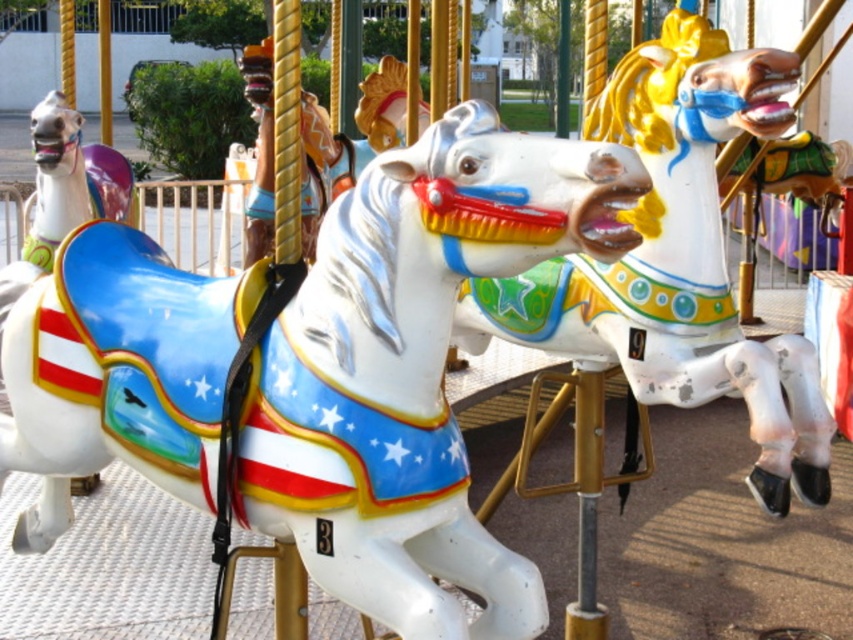
Does painted wood horse at center appear on the right side of shiny white horse at left?

Correct, you'll find painted wood horse at center to the right of shiny white horse at left.

Does painted wood horse at center appear under shiny white horse at left?

Yes.

Does point (740, 90) come closer to viewer compared to point (71, 131)?

Yes, point (740, 90) is in front of point (71, 131).

Identify the location of painted wood horse at center. (675, 259).

Which is behind, point (299, 500) or point (59, 106)?

The point (59, 106) is more distant.

Can you confirm if white glossy horse at center is bigger than shiny white horse at left?

Yes.

Describe the element at coordinates (413, 369) in the screenshot. The height and width of the screenshot is (640, 853). I see `white glossy horse at center` at that location.

Locate an element on the screen. The height and width of the screenshot is (640, 853). white glossy horse at center is located at coordinates (413, 369).

Who is higher up, white glossy horse at center or painted wood horse at center?

painted wood horse at center

Who is more forward, [358,285] or [815,451]?

Positioned in front is point [358,285].

Is point (125, 328) positioned before point (666, 40)?

Yes, point (125, 328) is closer to viewer.

Find the location of a particular element. Image resolution: width=853 pixels, height=640 pixels. white glossy horse at center is located at coordinates (413, 369).